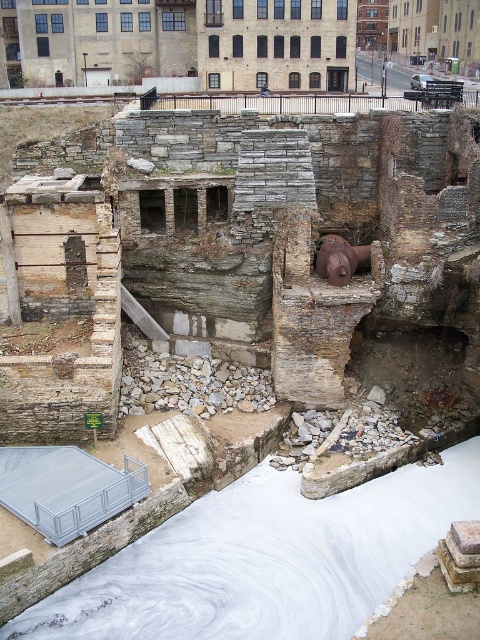
Question: Can you confirm if rusty stone ruins at center is positioned above white smooth water at center?

Choices:
 (A) yes
 (B) no

Answer: (A)

Question: Where is rusty stone ruins at center located in relation to white smooth water at center in the image?

Choices:
 (A) left
 (B) right

Answer: (A)

Question: Can you confirm if rusty stone ruins at center is positioned below white smooth water at center?

Choices:
 (A) yes
 (B) no

Answer: (B)

Question: Which point appears closest to the camera in this image?

Choices:
 (A) (40, 394)
 (B) (290, 545)

Answer: (B)